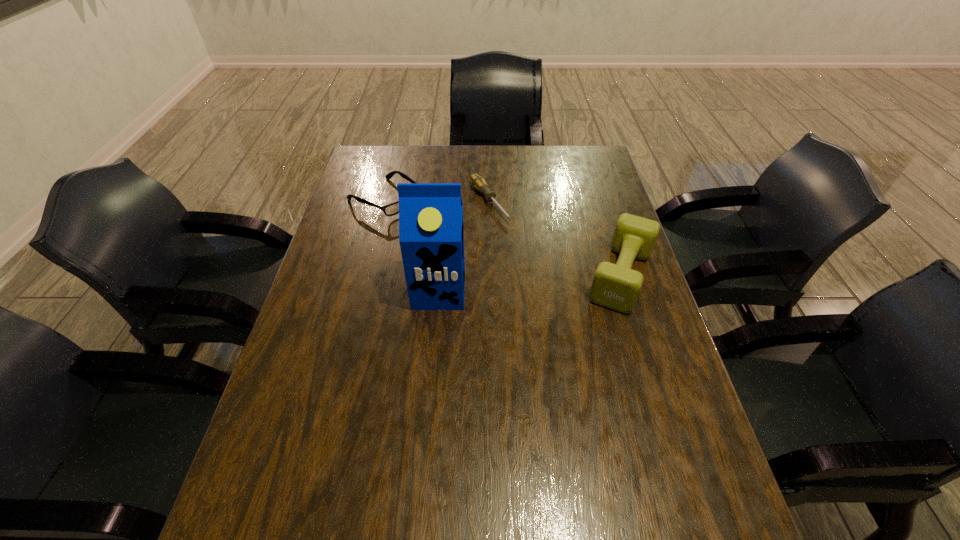
Find the location of a particular element. vacant region located 0.050m at the tip of the screwdriver is located at coordinates [507, 233].

This screenshot has width=960, height=540. What are the coordinates of `free space located 0.080m at the tip of the screwdriver` in the screenshot? It's located at (512, 238).

Image resolution: width=960 pixels, height=540 pixels. Find the location of `blank space located at the tip of the screwdriver`. blank space located at the tip of the screwdriver is located at coordinates (569, 308).

Find the location of `vacant space located on the front-facing side of the second shortest object`. vacant space located on the front-facing side of the second shortest object is located at coordinates (470, 252).

Find the location of `free location located 0.080m on the front-facing side of the second shortest object`. free location located 0.080m on the front-facing side of the second shortest object is located at coordinates (426, 225).

Locate an element on the screen. free location located 0.110m on the front-facing side of the second shortest object is located at coordinates (433, 228).

Locate an element on the screen. object that is positioned at the far edge is located at coordinates (392, 209).

Identify the location of object present at the left edge. (392, 209).

This screenshot has height=540, width=960. Identify the location of object that is positioned at the right edge. (616, 286).

The width and height of the screenshot is (960, 540). Identify the location of object at the far left corner. (392, 209).